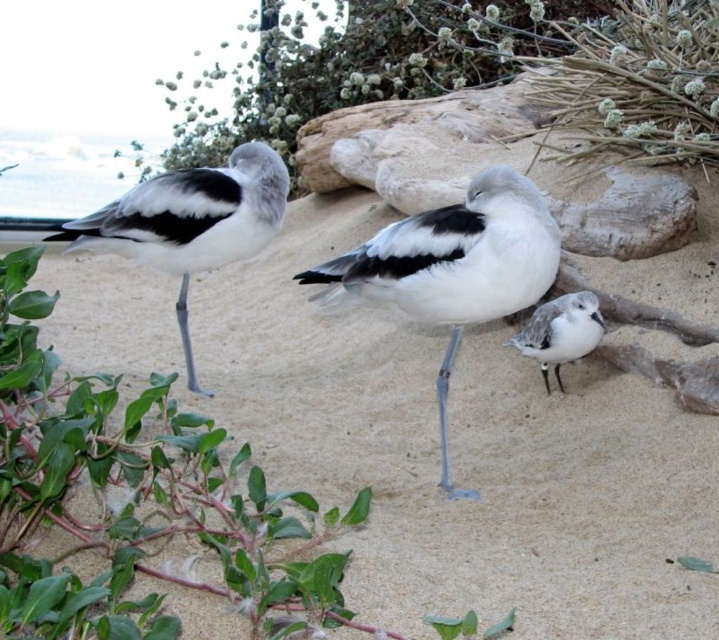
You are a photographer trying to capture a closeup of the green leafy plant at upper center and the white matte bird at left. You need to know which one is wider to adjust your camera settings. Can you tell me which object is wider?

The green leafy plant at upper center is wider than the white matte bird at left according to the description.